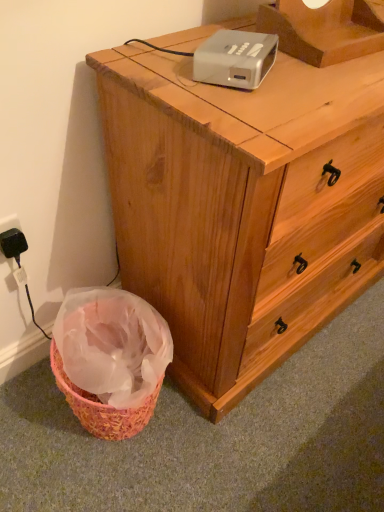
Identify the location of free location in front of white plastic projector at upper center. (245, 114).